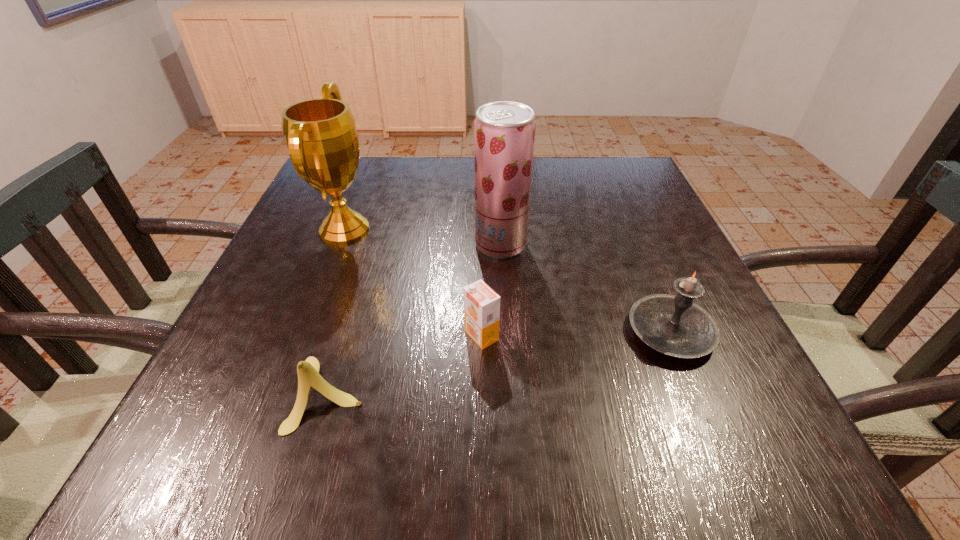
Image resolution: width=960 pixels, height=540 pixels. I want to click on fruit juice, so click(x=504, y=131).

Identify the location of award. The width and height of the screenshot is (960, 540). (321, 136).

You are a GUI agent. You are given a task and a screenshot of the screen. Output one action in this format:
    pyautogui.click(x=<x>, y=<y>)
    Task: Click on the rightmost object
    
    Given the screenshot: What is the action you would take?
    pyautogui.click(x=674, y=325)

Locate an element on the screen. The width and height of the screenshot is (960, 540). candle is located at coordinates (674, 325).

I want to click on orange juice, so click(x=481, y=304).

Identify the location of banana. (308, 371).

Locate an element on the screen. free space located 0.140m on the front of the fruit juice is located at coordinates (504, 309).

Find the location of `vacant space positioned on the front-facing side of the award`. vacant space positioned on the front-facing side of the award is located at coordinates (528, 230).

You are a GUI agent. You are given a task and a screenshot of the screen. Output one action in this format:
    pyautogui.click(x=<x>, y=<y>)
    Task: Click on the vacant space located 0.060m on the front of the rightmost object
    The height and width of the screenshot is (540, 960).
    Given the screenshot: What is the action you would take?
    pyautogui.click(x=698, y=398)

In order to click on vacant space located 0.300m on the back of the orange juice in this screenshot , I will do `click(481, 226)`.